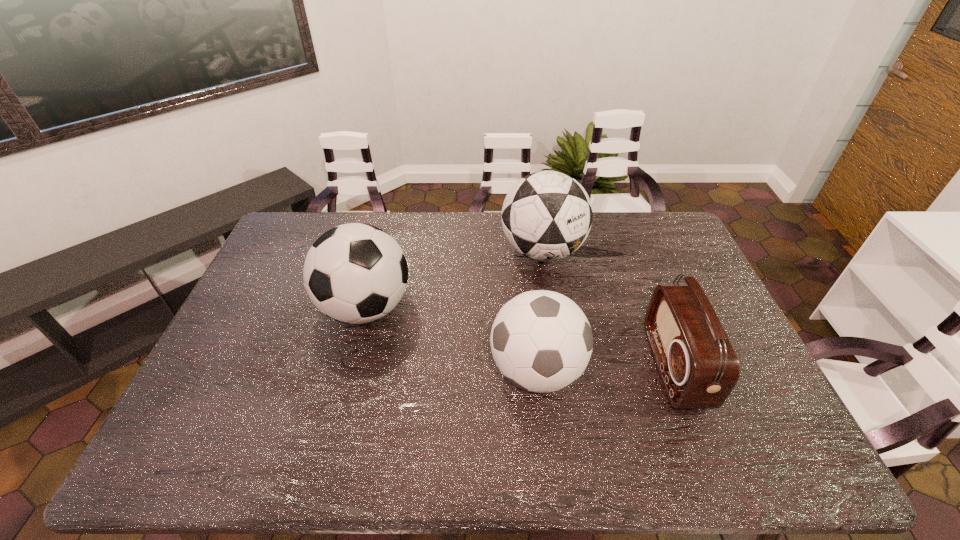
Identify the location of the leftmost object. (355, 273).

Image resolution: width=960 pixels, height=540 pixels. Identify the location of the rightmost object. (698, 366).

This screenshot has height=540, width=960. In order to click on vacant space positioned on the right of the leftmost object in this screenshot , I will do `click(484, 308)`.

Locate an element on the screen. This screenshot has width=960, height=540. free space located 0.170m on the front panel of the rightmost object is located at coordinates (593, 367).

The image size is (960, 540). I want to click on free region located on the front panel of the rightmost object, so click(615, 367).

Identify the location of blank space located 0.200m on the front panel of the rightmost object. This screenshot has width=960, height=540. (582, 367).

The width and height of the screenshot is (960, 540). In order to click on object situated at the far edge in this screenshot , I will do `click(547, 215)`.

Identify the location of object located in the right edge section of the desktop. (698, 366).

Locate an element on the screen. The height and width of the screenshot is (540, 960). free region at the far edge of the desktop is located at coordinates (422, 225).

This screenshot has width=960, height=540. Identify the location of vacant space at the near edge. (449, 436).